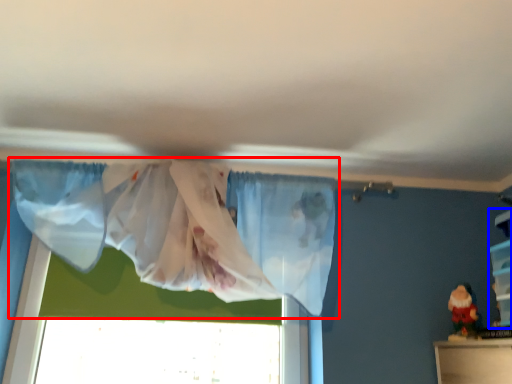
Question: Which point is closer to the camera, curtain (highlighted by a red box) or shelf (highlighted by a blue box)?

Choices:
 (A) curtain
 (B) shelf

Answer: (A)